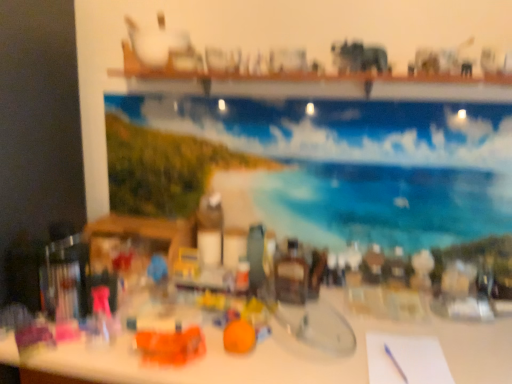
Locate an element on the screen. free space between orange plastic toy at center, placed as the first toy when sorted from left to right, and white paper at lower right is located at coordinates (300, 359).